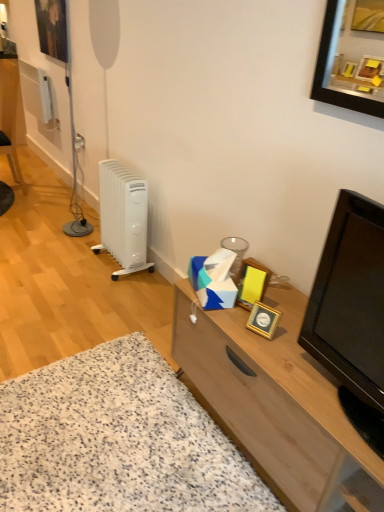
The image size is (384, 512). I want to click on free space in front of gold metallic picture frame at center-right, which ranks as the 3th picture frame in top-to-bottom order, so click(x=282, y=360).